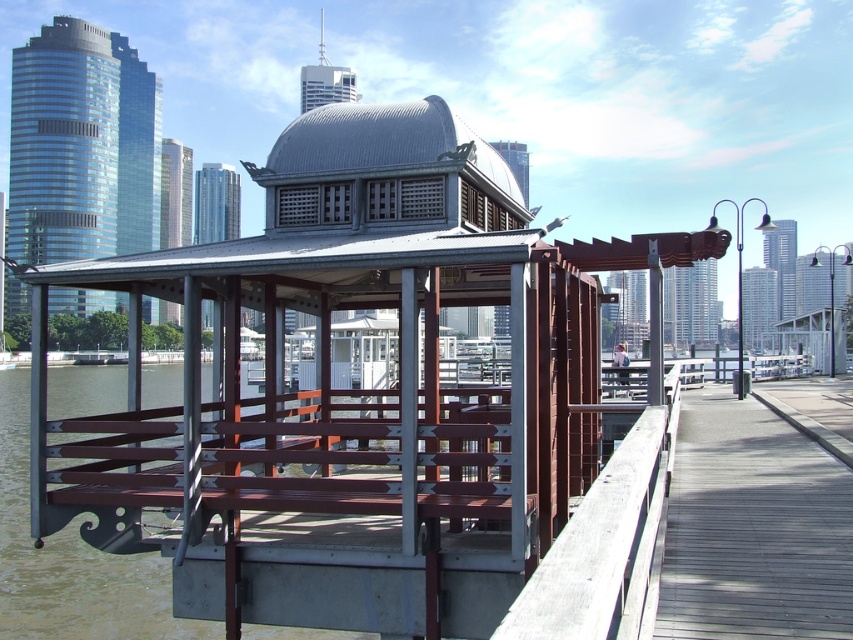
Which is above, metallic/glossy gazebo at center or wooden at right?

metallic/glossy gazebo at center is above.

Looking at this image, which is more to the right, metallic/glossy gazebo at center or wooden at right?

Positioned to the right is wooden at right.

Is point (285, 500) farther from viewer compared to point (849, 616)?

Yes.

You are a GUI agent. You are given a task and a screenshot of the screen. Output one action in this format:
    pyautogui.click(x=<x>, y=<y>)
    Task: Click on the metallic/glossy gazebo at center
    This screenshot has height=640, width=853.
    Given the screenshot: What is the action you would take?
    pyautogui.click(x=355, y=388)